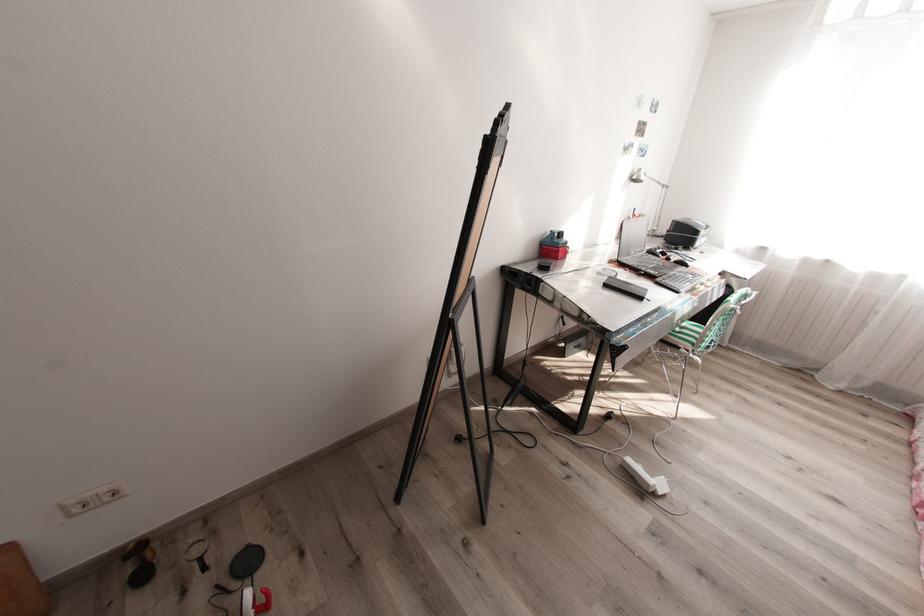
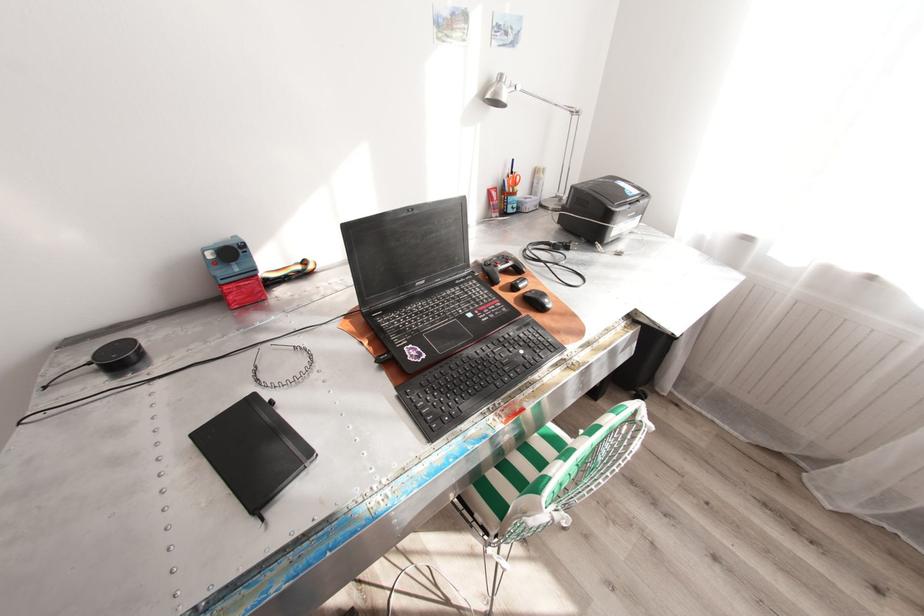
Locate, in the second image, the point that corresponds to [561,235] in the first image.

(215, 254)